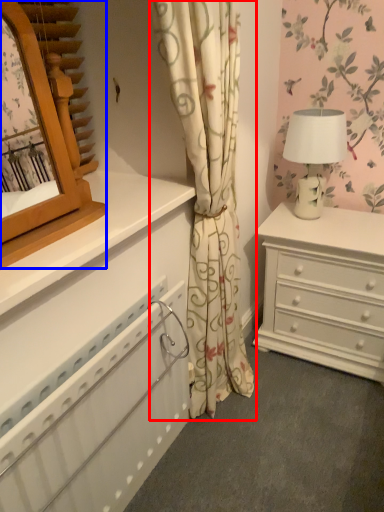
Question: Among these objects, which one is farthest to the camera, curtain (highlighted by a red box) or mirror (highlighted by a blue box)?

Choices:
 (A) curtain
 (B) mirror

Answer: (A)